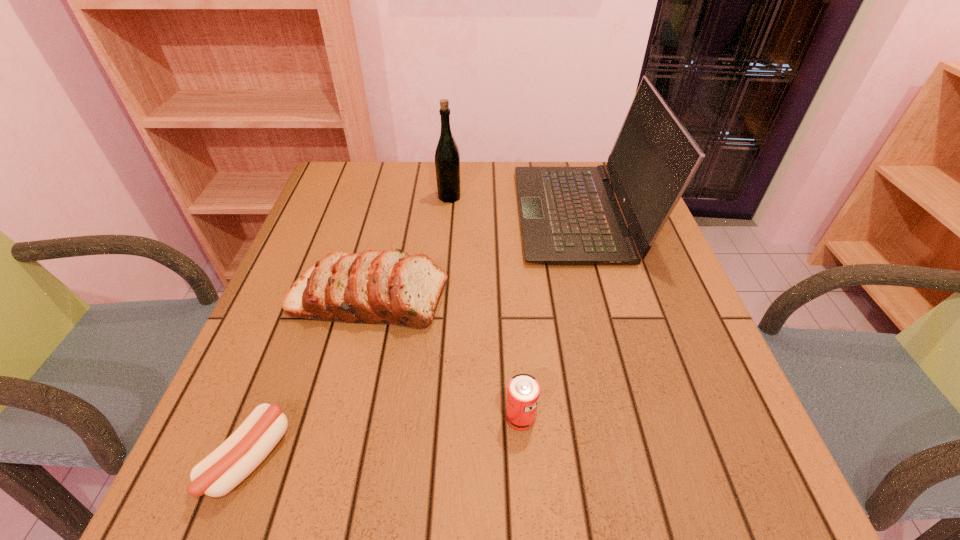
Where is `free spot located 0.360m on the back of the second object from right to left`? free spot located 0.360m on the back of the second object from right to left is located at coordinates (510, 265).

Locate an element on the screen. Image resolution: width=960 pixels, height=540 pixels. free spot located on the right of the shortest object is located at coordinates tap(406, 459).

What are the coordinates of `laptop computer that is at the far edge` in the screenshot? It's located at (569, 215).

Image resolution: width=960 pixels, height=540 pixels. Identify the location of beer bottle present at the far edge. (447, 157).

Find the location of a particular element. The image size is (960, 540). object that is positioned at the near edge is located at coordinates (243, 451).

This screenshot has width=960, height=540. Find the location of `bread positioned at the left edge`. bread positioned at the left edge is located at coordinates [390, 287].

The width and height of the screenshot is (960, 540). I want to click on sausage present at the left edge, so click(x=243, y=451).

Image resolution: width=960 pixels, height=540 pixels. Find the location of `object that is at the right edge`. object that is at the right edge is located at coordinates (569, 215).

The width and height of the screenshot is (960, 540). Identify the location of object present at the near left corner. (243, 451).

Where is `object that is at the far right corner`? object that is at the far right corner is located at coordinates (569, 215).